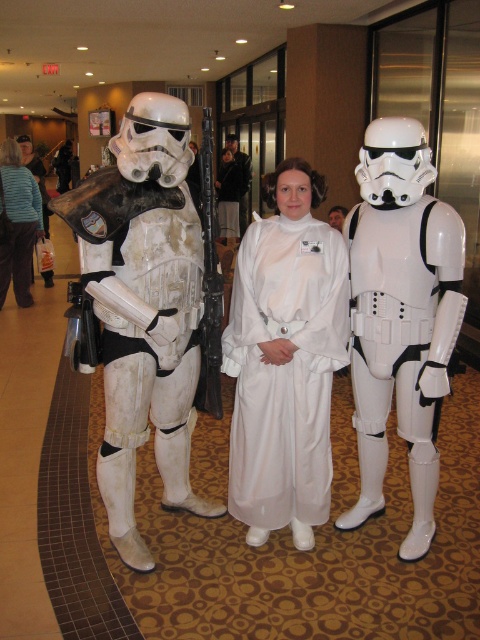
Is white satin dress at center to the right of white matte stormtrooper armor at right from the viewer's perspective?

Incorrect, white satin dress at center is not on the right side of white matte stormtrooper armor at right.

Describe the element at coordinates (285, 369) in the screenshot. I see `white satin dress at center` at that location.

Locate an element on the screen. This screenshot has width=480, height=640. white satin dress at center is located at coordinates (285, 369).

This screenshot has height=640, width=480. Find the location of `white satin dress at center`. white satin dress at center is located at coordinates (285, 369).

Is white matte stormtrooper armor at left smaller than matte black jacket at left?

Incorrect, white matte stormtrooper armor at left is not smaller in size than matte black jacket at left.

Does point (105, 406) come in front of point (28, 188)?

Yes, point (105, 406) is closer to viewer.

Find the location of a particular element. white matte stormtrooper armor at left is located at coordinates (142, 326).

Which is above, white matte/soft fabric dress at center or white matte helmet at center?

white matte/soft fabric dress at center

Does white matte/soft fabric dress at center appear under white matte helmet at center?

Incorrect, white matte/soft fabric dress at center is not positioned below white matte helmet at center.

Is point (216, 196) closer to viewer compared to point (27, 152)?

No, it is not.

Image resolution: width=480 pixels, height=640 pixels. I want to click on white matte/soft fabric dress at center, so click(x=228, y=195).